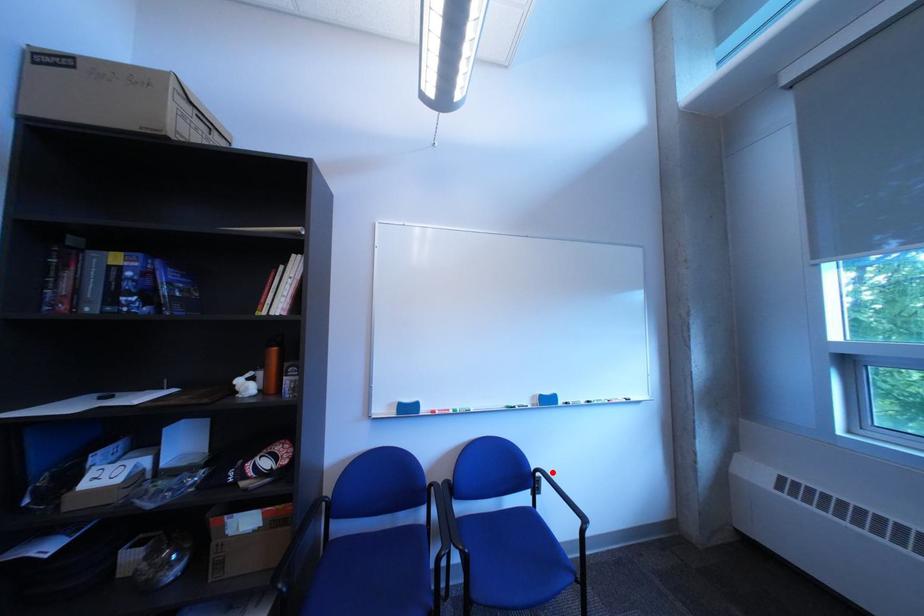
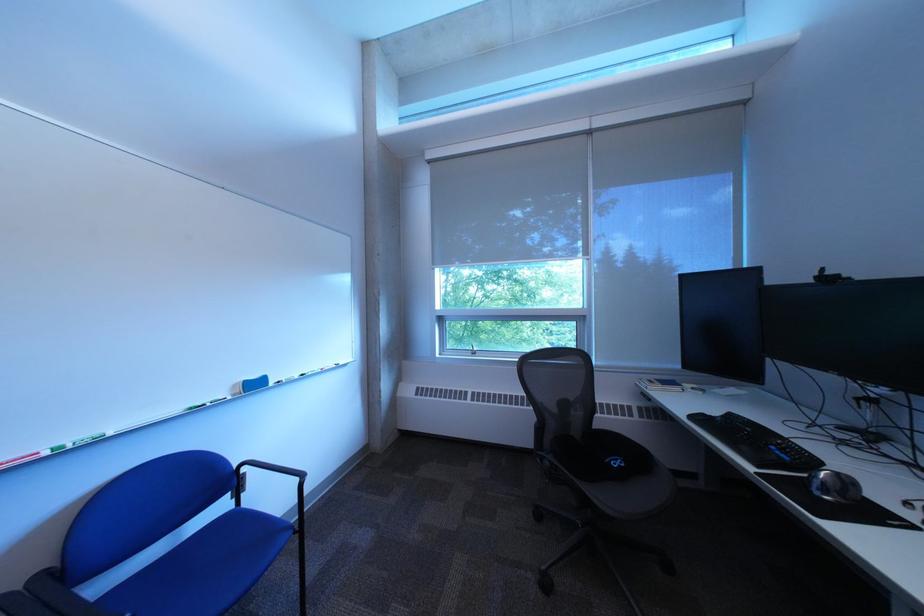
Question: I am providing you with two images of the same scene from different viewpoints. In image1, a red point is highlighted. Considering the same 3D point in image2, which of the following is correct?

Choices:
 (A) It is closer
 (B) It is farther

Answer: (A)